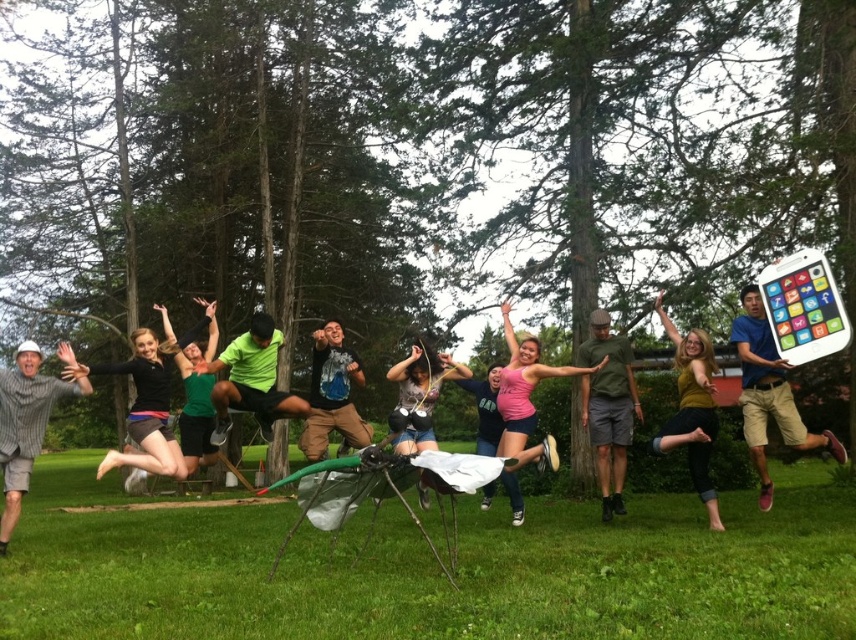
You are a photographer standing at the edge of the grassy area. You want to capture the spider structure and the group of people in your shot. The tablet at center shows a map with a point marked at coordinates (768, 392). Where should you position your camera to ensure both the spider structure and the group are in frame?

The point at coordinates (768, 392) on the white matte tablet at center indicates the optimal camera position. By placing your camera at this point, you can capture both the spider structure and the group of people in the frame.

You are a photographer trying to capture the perfect shot of the group. You notice the black matte shorts at center and the pink matte shirt at center. Which object should you focus on first if you want to capture the one that is positioned to the right?

The pink matte shirt at center should be focused on first because the black matte shorts at center is to the left of it, meaning the pink matte shirt at center is positioned to the right.

You are a photographer trying to capture the dynamic poses of the group. You notice the black matte shorts at center and the pink matte shirt at center. Which object is positioned higher in the image?

The black matte shorts at center is above the pink matte shirt at center, so it is positioned higher in the image.